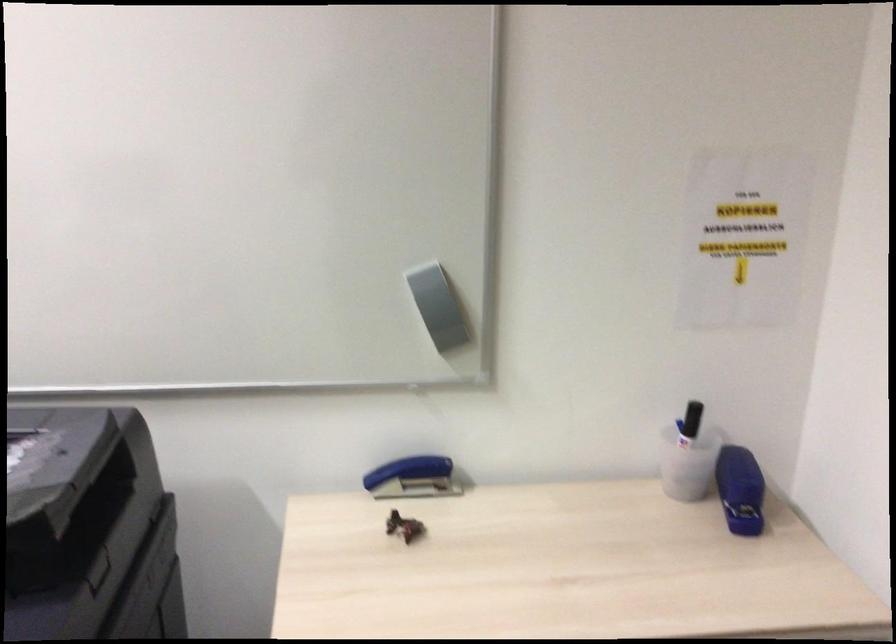
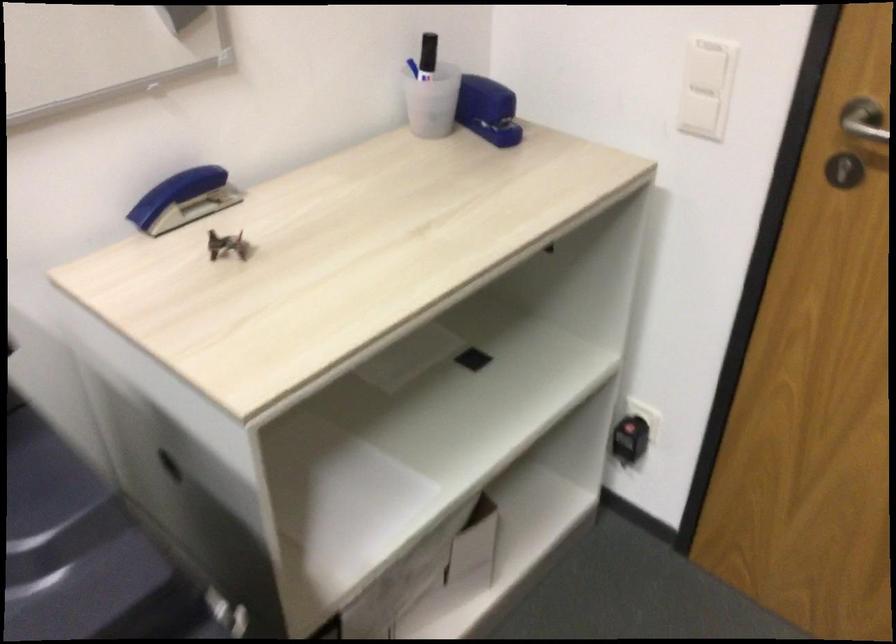
Where in the second image is the point corresponding to (409,471) from the first image?

(184, 199)